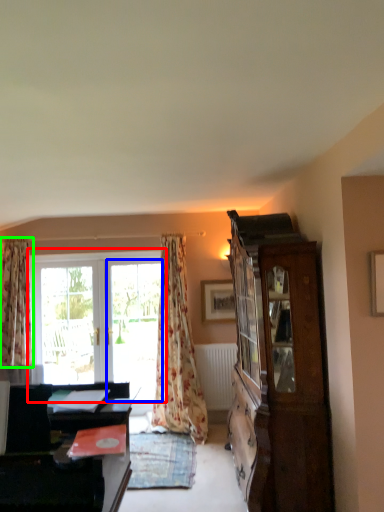
Question: Based on their relative distances, which object is nearer to window (highlighted by a red box)? Choose from screen door (highlighted by a blue box) and curtain (highlighted by a green box).

Choices:
 (A) screen door
 (B) curtain

Answer: (A)